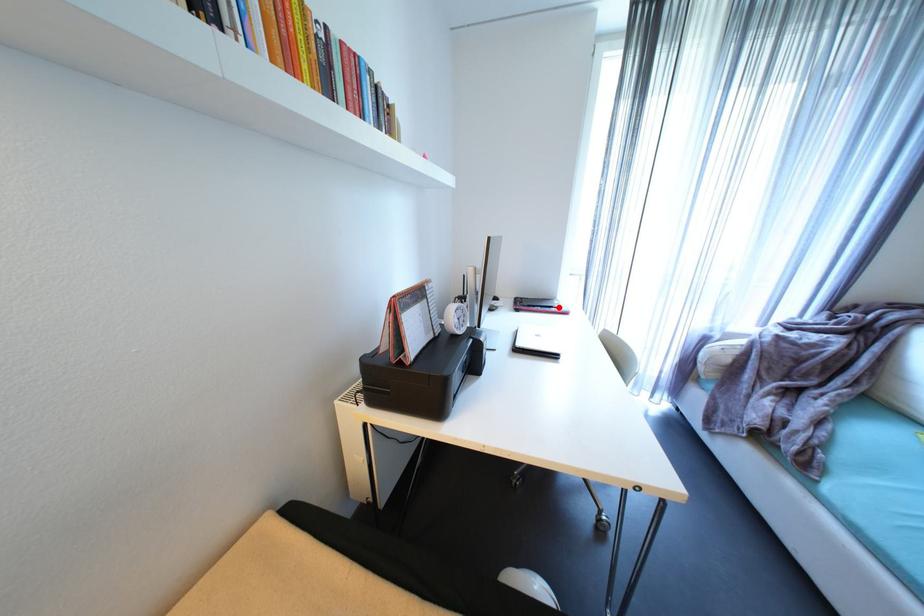
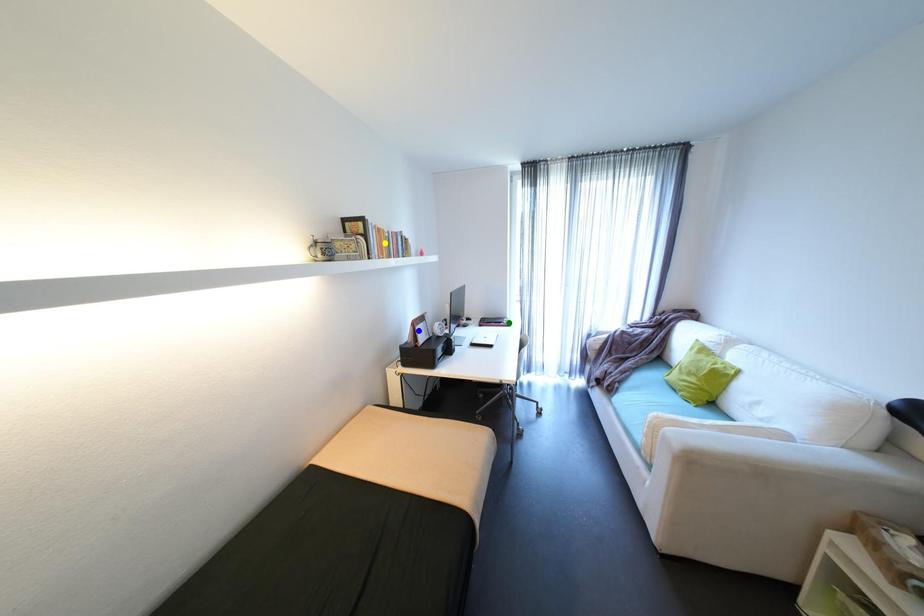
Question: I am providing you with two images of the same scene from different viewpoints. A red point is marked on the first image. You are given multiple points on the second image. Which spot in image 2 lines up with the point in image 1?

Choices:
 (A) yellow point
 (B) green point
 (C) blue point

Answer: (B)